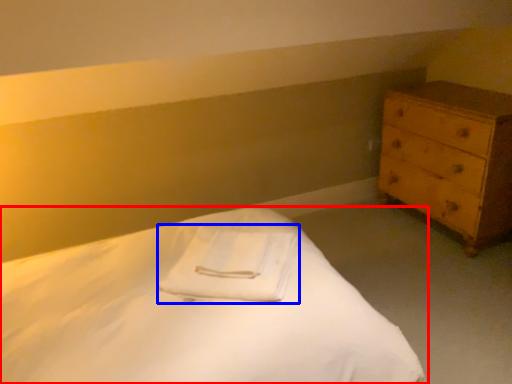
Question: Which point is further to the camera, bed (highlighted by a red box) or cloth (highlighted by a blue box)?

Choices:
 (A) bed
 (B) cloth

Answer: (B)